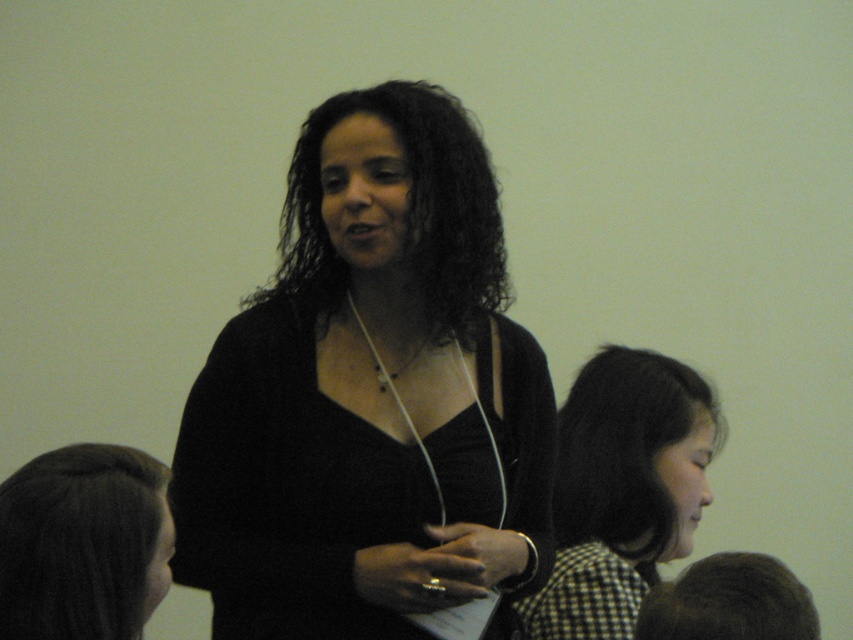
You are organizing a photo shoot and need to arrange two models based on their hair width. The models are the dark curly hair at center and the dark brown hair at lower right. Which model should you place in a position that requires wider space due to their hair width?

The dark curly hair at center should be placed in the position requiring wider space because its width is larger than the dark brown hair at lower right.

You are an event planner organizing a photo shoot. You need to position two models with dark brown hair in the scene. The models are represented by the dark brown hair at lower left and dark brown hair at lower right. Which model should you place closer to the camera to ensure their hair appears larger in the photo?

The dark brown hair at lower left is already larger in size compared to the dark brown hair at lower right. To ensure the model with dark brown hair at lower left appears larger in the photo, place them closer to the camera since their hair is already larger, indicating they are nearer to the viewer.